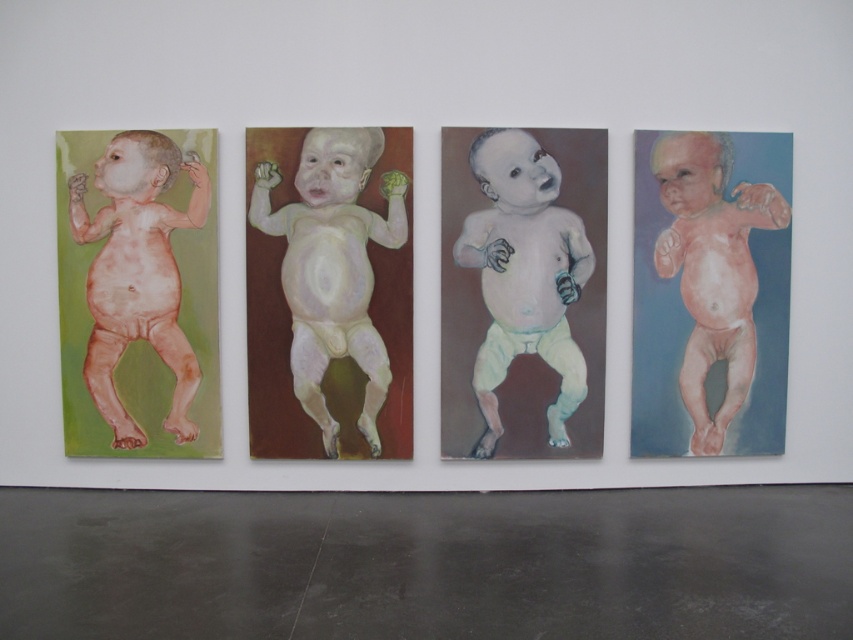
You are standing at the point marked by the coordinate point at (550, 436). You want to walk to the nearest painting. Which one is closest to you?

The nearest painting to the point marked by the coordinate point at (550, 436) is the second painting, as they are 16.31 feet apart.

You are standing in the gallery and want to take a closer look at the matte pastel baby at center. If your current position is 5 meters away from the painting, can you walk forward to get within 4 meters of it?

The matte pastel baby at center is currently 4.84 meters away. Since you are already at 5 meters, moving forward would bring you closer. However, the question asks if you can get within 4 meters. Since 4.84 meters is greater than 4 meters, you cannot reduce the distance to below 4 meters unless the painting moves, which it can not. Therefore, you cannot get within 4 meters of the matte pastel baby at center.